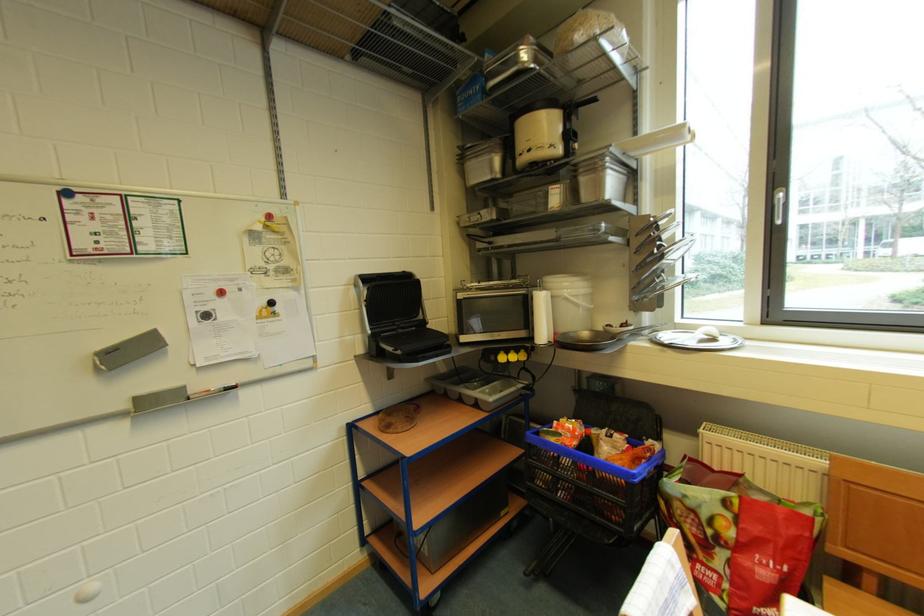
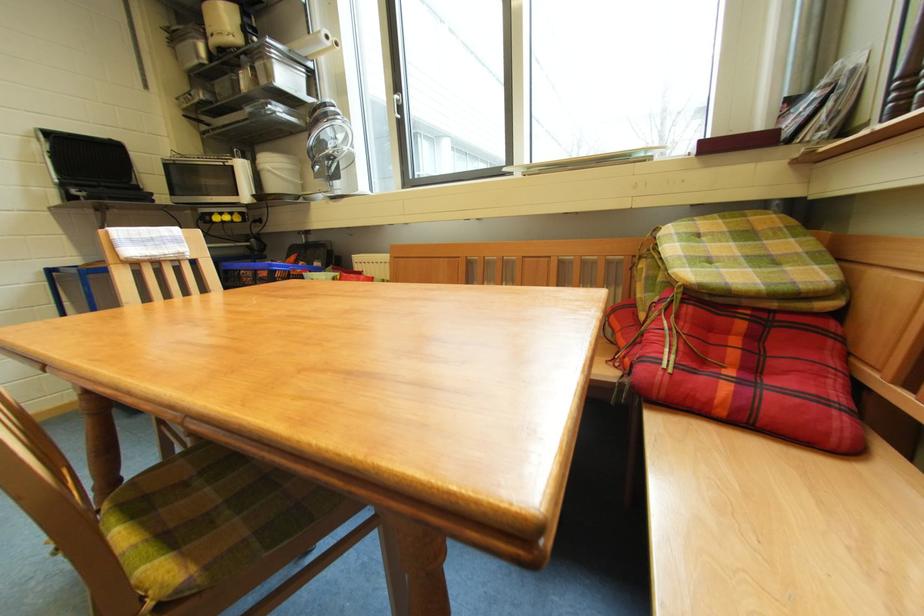
Question: I am providing you with two images of the same scene from different viewpoints. Which of the following objects are not visible in image2?

Choices:
 (A) small chrome fan
 (B) chair sitting surface
 (C) green plaid cushion
 (D) none of these

Answer: (D)